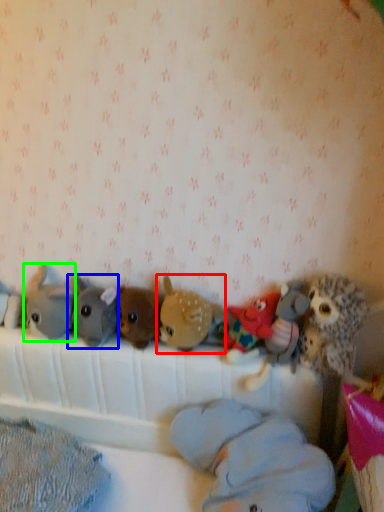
Question: Estimate the real-world distances between objects in this image. Which object is closer to toy (highlighted by a red box), toy (highlighted by a blue box) or toy (highlighted by a green box)?

Choices:
 (A) toy
 (B) toy

Answer: (A)